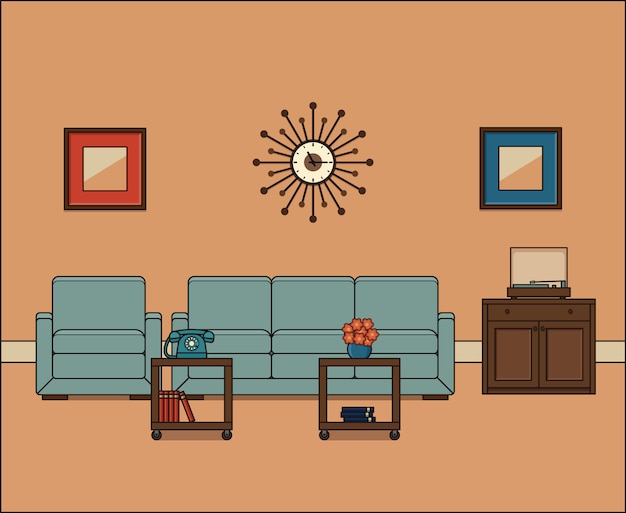
The image size is (626, 513). Find the location of `phonograph`. phonograph is located at coordinates (543, 288).